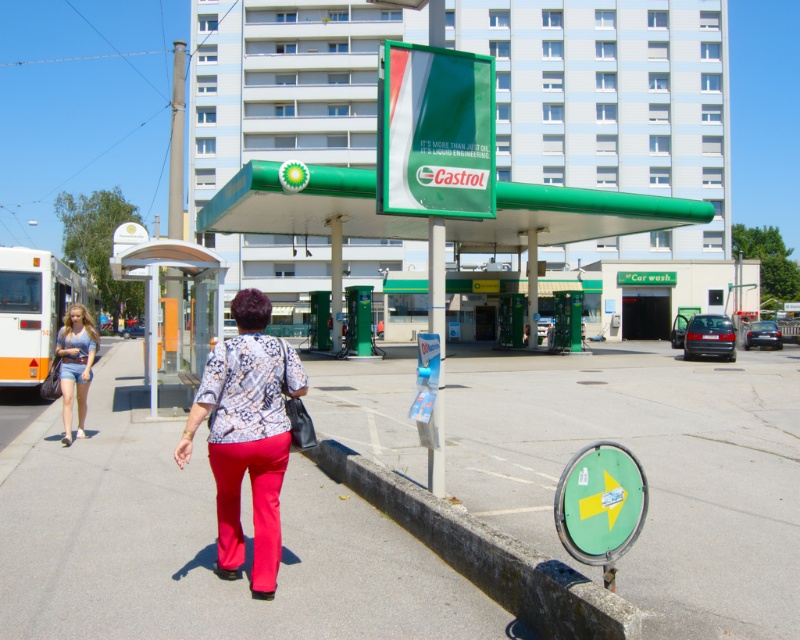
You are a customer at the BP gas station and see the matte red pants at center and the denim shorts at left. Which one is closer to the entrance of the gas station?

The matte red pants at center is closer to the entrance of the gas station because it is in front of the denim shorts at left.

You are standing at the BP gas station and want to walk to the car wash. You see the concrete at lower right and denim shorts at left. Which direction should you go to reach the car wash?

The concrete at lower right is in front of denim shorts at left, so to reach the car wash, you should go towards the concrete at lower right as it is closer to your current position in front of the denim shorts at left.